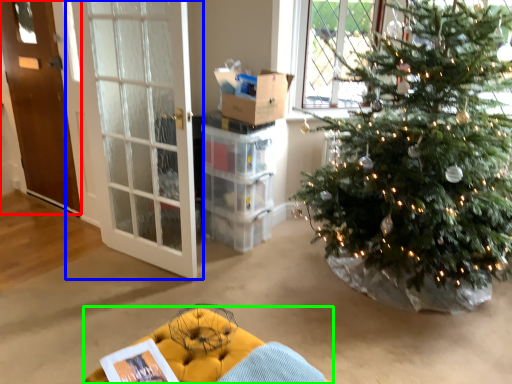
Question: Estimate the real-world distances between objects in this image. Which object is closer to door (highlighted by a red box), door (highlighted by a blue box) or furniture (highlighted by a green box)?

Choices:
 (A) door
 (B) furniture

Answer: (A)